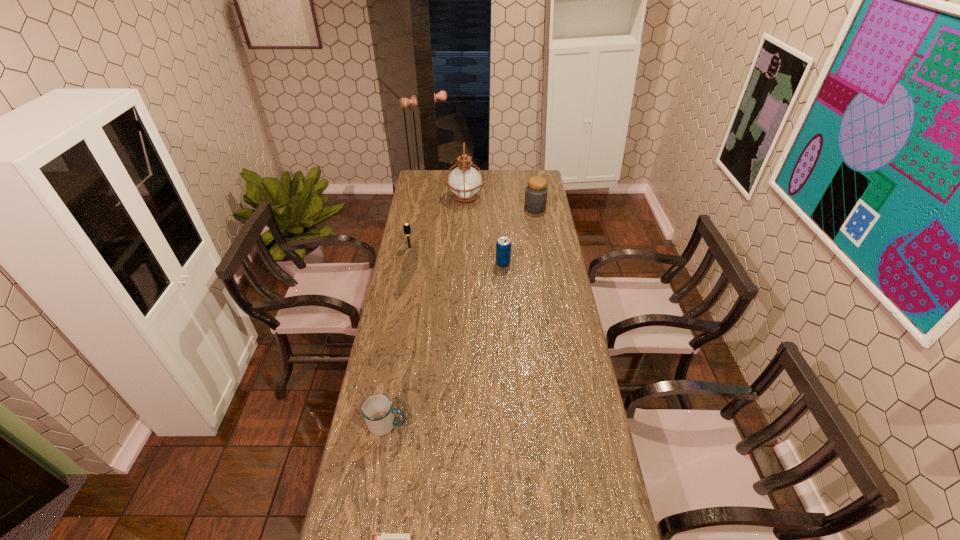
The height and width of the screenshot is (540, 960). What are the coordinates of `vacant space located 0.200m on the surface of the fifth shortest object near the warning symbol` in the screenshot? It's located at (486, 208).

Where is `vacant area located on the surface of the fifth shortest object near the warning symbol`? This screenshot has width=960, height=540. vacant area located on the surface of the fifth shortest object near the warning symbol is located at coordinates (467, 208).

You are a GUI agent. You are given a task and a screenshot of the screen. Output one action in this format:
    pyautogui.click(x=<x>, y=<y>)
    Task: Click on the free spot located on the back of the hairbrush
    Image resolution: width=960 pixels, height=540 pixels.
    Given the screenshot: What is the action you would take?
    pyautogui.click(x=414, y=225)

Find the location of `free spot located on the front of the pop soda`. free spot located on the front of the pop soda is located at coordinates (506, 312).

The width and height of the screenshot is (960, 540). In order to click on free spot located on the handle side of the fifth farthest object in this screenshot , I will do `click(521, 425)`.

You are a GUI agent. You are given a task and a screenshot of the screen. Output one action in this format:
    pyautogui.click(x=<x>, y=<y>)
    Task: Click on the object located at the far edge
    The image size is (960, 540).
    Given the screenshot: What is the action you would take?
    pyautogui.click(x=464, y=182)

Identify the location of hairbrush located at the left edge. (406, 227).

Find the location of a particular element. Image resolution: width=960 pixels, height=540 pixels. mug at the left edge is located at coordinates (377, 409).

Where is `object located in the right edge section of the desktop`? This screenshot has height=540, width=960. object located in the right edge section of the desktop is located at coordinates (536, 192).

The width and height of the screenshot is (960, 540). Find the location of `free space at the left edge of the desktop`. free space at the left edge of the desktop is located at coordinates (348, 496).